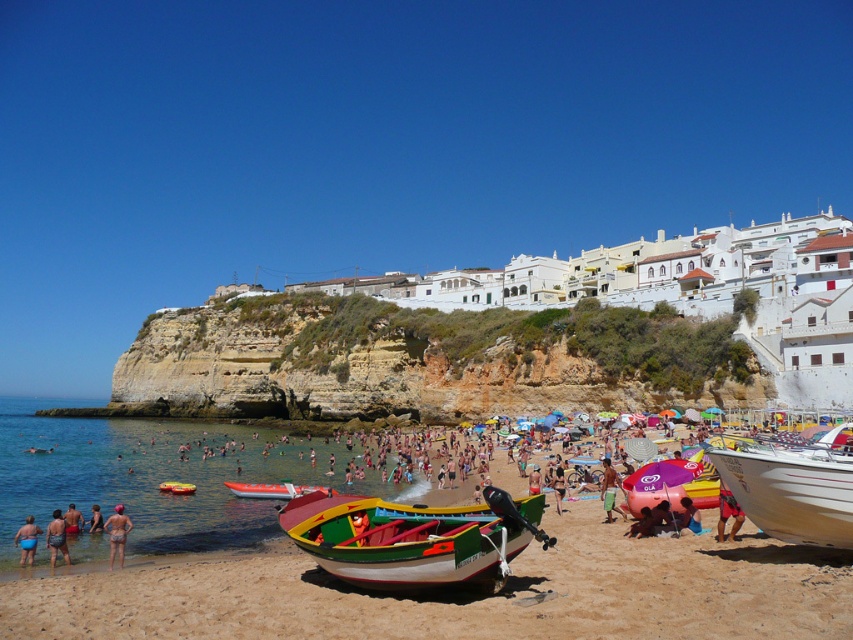
Question: Is orange fiberglass boat at center wider than red fabric shorts at lower right?

Choices:
 (A) no
 (B) yes

Answer: (B)

Question: Is blue matte swimsuit at lower left positioned in front of red glossy boat at lower left?

Choices:
 (A) no
 (B) yes

Answer: (B)

Question: Which of the following is the farthest from the observer?

Choices:
 (A) (305, 490)
 (B) (721, 525)
 (C) (685, 461)

Answer: (A)

Question: Does purple glossy inflatable at center appear under tan skin human at center?

Choices:
 (A) no
 (B) yes

Answer: (A)

Question: Based on their relative distances, which object is farther from the matte skin person at lower left?

Choices:
 (A) orange fiberglass boat at center
 (B) dark blue swimsuit at lower left
 (C) tan skin human at center

Answer: (C)

Question: Which object is positioned closest to the tan skin human at center?

Choices:
 (A) green fabric bucket at center
 (B) red fabric shorts at lower right
 (C) wooden boat at center
 (D) blue matte swimsuit at lower left

Answer: (A)